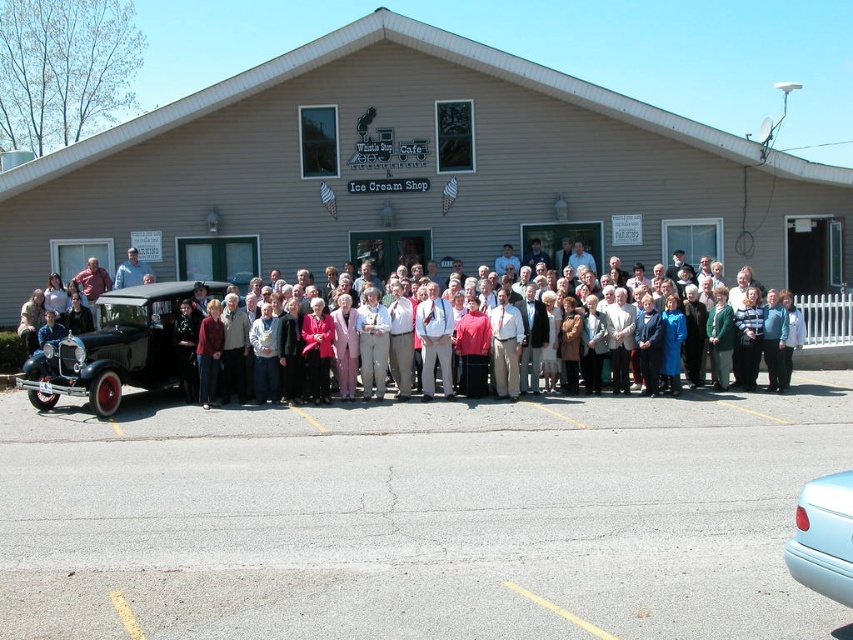
Does beige siding building at center appear over matte pink sweater at center?

Yes.

Does point (505, 64) come farther from viewer compared to point (218, 259)?

No, (505, 64) is closer to viewer.

You are a GUI agent. You are given a task and a screenshot of the screen. Output one action in this format:
    pyautogui.click(x=<x>, y=<y>)
    Task: Click on the beige siding building at center
    
    Given the screenshot: What is the action you would take?
    pyautogui.click(x=415, y=173)

Which is behind, point (151, 332) or point (212, 264)?

The point (212, 264) is behind.

Between shiny black car at left and matte pink sweater at center, which one has less height?

With less height is matte pink sweater at center.

Between point (42, 365) and point (219, 259), which one is positioned in front?

Point (42, 365)

This screenshot has width=853, height=640. I want to click on shiny black car at left, so click(112, 349).

Is shiny black car at left shorter than light blue glossy car at lower right?

No, shiny black car at left is not shorter than light blue glossy car at lower right.

Is point (90, 380) in front of point (808, 564)?

No, it is behind (808, 564).

Find the location of `shiny black car at left`. shiny black car at left is located at coordinates (112, 349).